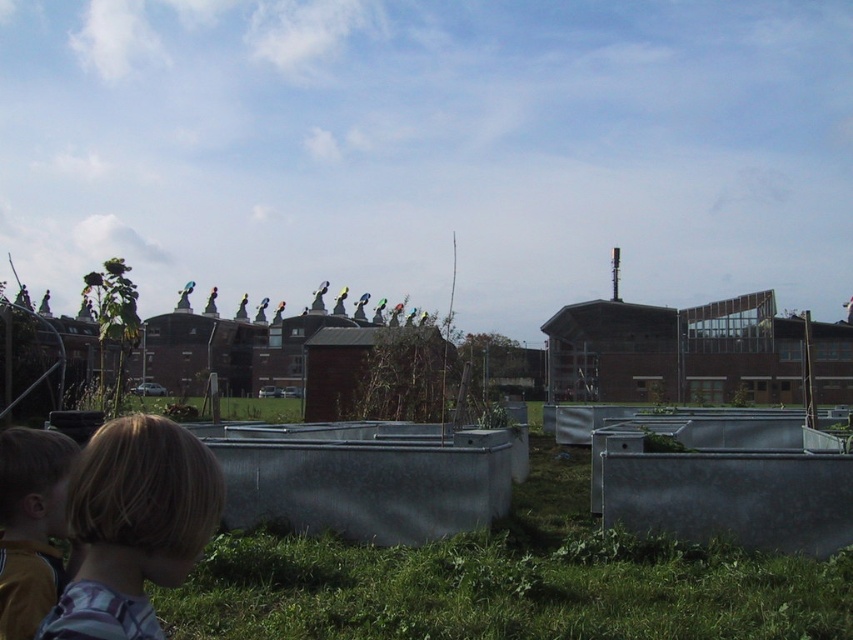
You are standing at the origin point in the image. Which of the two points, point 1 at coordinates (161, 484) or point 2 at coordinates (51, 465), is closer to you?

Point 1 at coordinates (161, 484) is closer to you because it is in front of point 2 at coordinates (51, 465).

In the scene shown: You are a photographer trying to capture a photo of the blonde hair at lower left and the yellow jersey at lower left. If you want to ensure both are fully visible in the frame without cropping, which object requires more space horizontally?

The blonde hair at lower left requires more space horizontally because its width surpasses that of the yellow jersey at lower left.